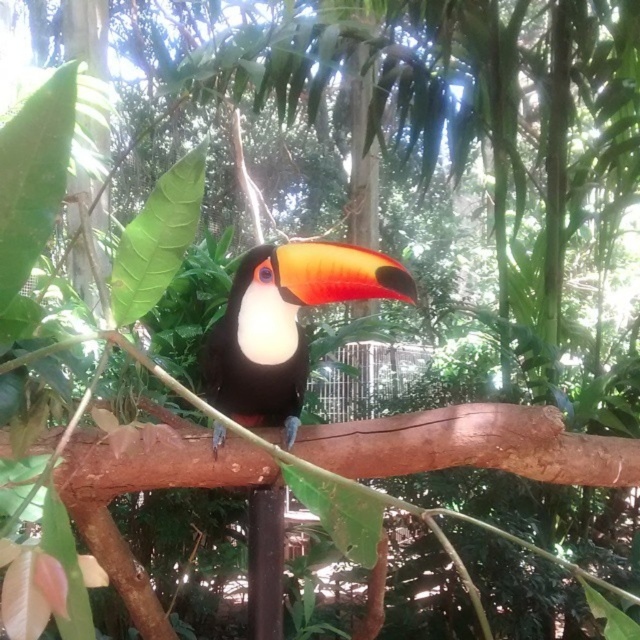
In the scene shown: You are a birdwatcher observing the scene. You notice the brown rough tree branch at center and the shiny black toucan at center. Which object is positioned lower in the image?

The brown rough tree branch at center is positioned below the shiny black toucan at center, so it is lower in the image.

You are a birdwatcher observing the toucan in the image. You notice a specific point at coordinates [472,445]. What object does this point correspond to?

The point at coordinates [472,445] corresponds to the brown rough tree branch at center.